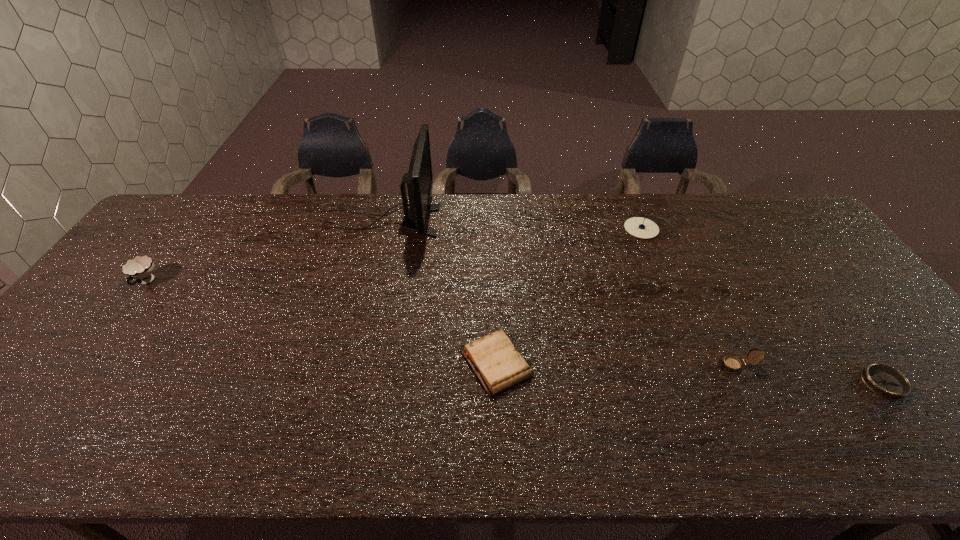
Choose which object is the third nearest neighbor to the computer monitor. Please provide its 2D coordinates. Your answer should be formatted as a tuple, i.e. [(x, y)], where the tuple contains the x and y coordinates of a point satisfying the conditions above.

[(639, 227)]

Identify which object is the fifth nearest to the cup. Please provide its 2D coordinates. Your answer should be formatted as a tuple, i.e. [(x, y)], where the tuple contains the x and y coordinates of a point satisfying the conditions above.

[(887, 382)]

This screenshot has width=960, height=540. Identify the location of compass that stands as the second closest to the farthest compass. (887, 382).

Identify which compass is located as the second nearest to the cup. Please provide its 2D coordinates. Your answer should be formatted as a tuple, i.e. [(x, y)], where the tuple contains the x and y coordinates of a point satisfying the conditions above.

[(731, 363)]

Find the location of a particular element. This screenshot has height=540, width=960. vacant area that satisfies the following two spatial constraints: 1. on the screen side of the tallest object; 2. on the left side of the farthest compass is located at coordinates (380, 228).

Find the location of a particular element. vacant space that satisfies the following two spatial constraints: 1. on the screen side of the tallest object; 2. on the side of the third farthest object with the handle is located at coordinates (367, 282).

In order to click on free space that satisfies the following two spatial constraints: 1. on the screen side of the computer monitor; 2. on the right side of the farthest compass in this screenshot , I will do `click(380, 228)`.

Find the location of a particular element. The image size is (960, 540). vacant space that satisfies the following two spatial constraints: 1. on the side of the fourth nearest object with the handle; 2. on the left side of the fourth object from right to left is located at coordinates (86, 363).

Locate an element on the screen. This screenshot has height=540, width=960. free spot that satisfies the following two spatial constraints: 1. on the screen side of the fourth object from right to left; 2. on the left side of the computer monitor is located at coordinates (347, 363).

Identify the location of vacant region that satisfies the following two spatial constraints: 1. on the screen side of the fifth object from right to left; 2. on the back side of the fourth object from right to left. (347, 363).